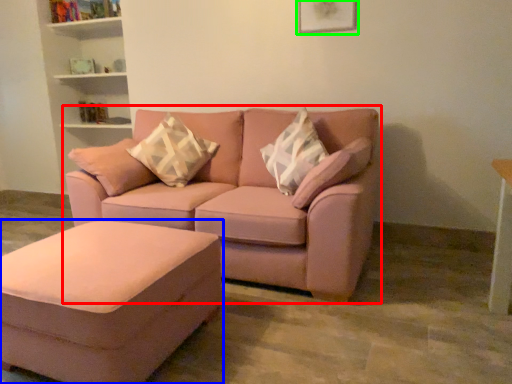
Question: Considering the real-world distances, which object is closest to studio couch (highlighted by a red box)? table (highlighted by a blue box) or picture frame (highlighted by a green box).

Choices:
 (A) table
 (B) picture frame

Answer: (A)